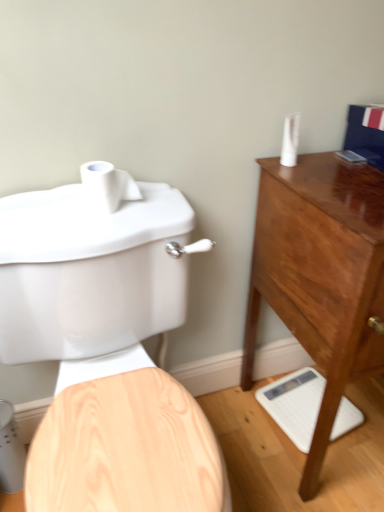
I want to click on spots to the right of white plastic toothpaste tube at upper right, so click(x=339, y=163).